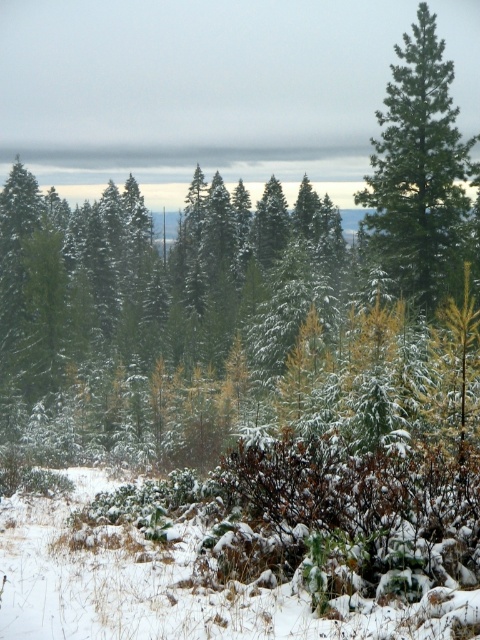
Question: From the image, what is the correct spatial relationship of white fluffy snow at lower center in relation to green matte tree at upper right?

Choices:
 (A) below
 (B) above

Answer: (A)

Question: Which point is farther from the camera taking this photo?

Choices:
 (A) (16, 556)
 (B) (431, 228)

Answer: (B)

Question: Which object appears farthest from the camera in this image?

Choices:
 (A) green matte tree at upper right
 (B) white fluffy snow at lower center

Answer: (A)

Question: Does white fluffy snow at lower center have a lesser width compared to green matte tree at upper right?

Choices:
 (A) yes
 (B) no

Answer: (B)

Question: Is white fluffy snow at lower center bigger than green matte tree at upper right?

Choices:
 (A) no
 (B) yes

Answer: (A)